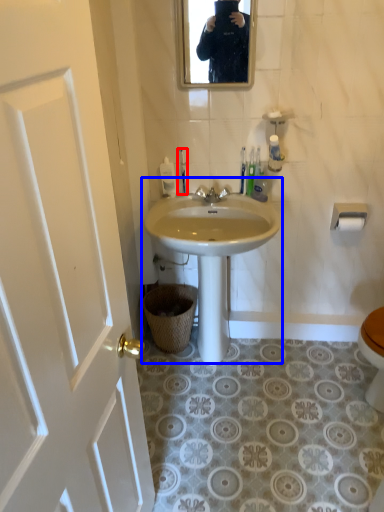
Question: Which of the following is the farthest to the observer, toilet brush (highlighted by a red box) or sink (highlighted by a blue box)?

Choices:
 (A) toilet brush
 (B) sink

Answer: (A)